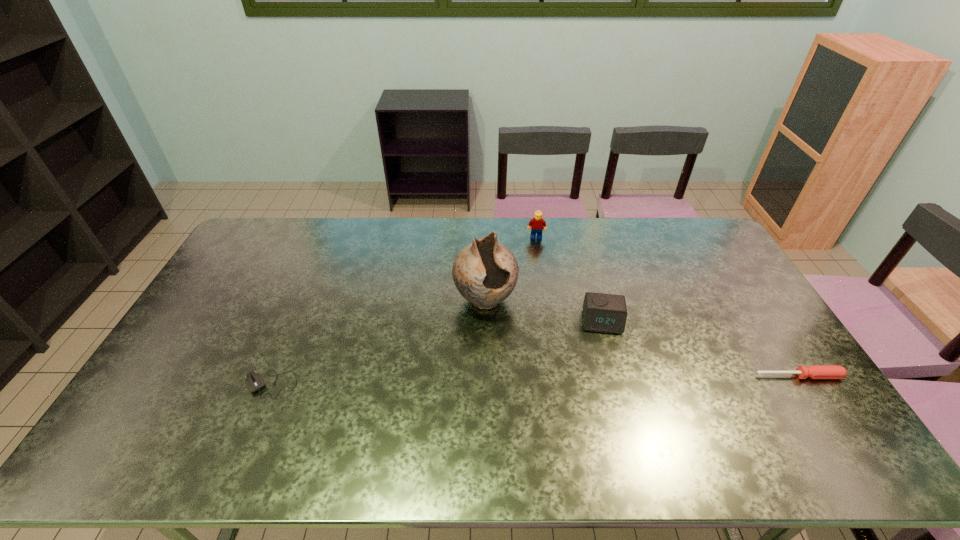
This screenshot has width=960, height=540. What are the coordinates of `computer mouse` in the screenshot? It's located at (254, 381).

Image resolution: width=960 pixels, height=540 pixels. Identify the location of the shortest object. (254, 381).

The image size is (960, 540). In order to click on screwdriver in this screenshot , I will do `click(813, 371)`.

Where is `the fourth tallest object`? the fourth tallest object is located at coordinates (813, 371).

What are the coordinates of `the third object from left to right` in the screenshot? It's located at (536, 224).

Locate an element on the screen. The width and height of the screenshot is (960, 540). the farthest object is located at coordinates click(536, 224).

In order to click on the tallest object in this screenshot , I will do `click(485, 272)`.

Find the location of `the second object from left to right`. the second object from left to right is located at coordinates (485, 272).

At what (x,y) coordinates should I click in order to perform the action: click on alarm clock. Please return your answer as a coordinate pair (x, y). Looking at the image, I should click on (602, 312).

Identify the location of the second object from right to left. (602, 312).